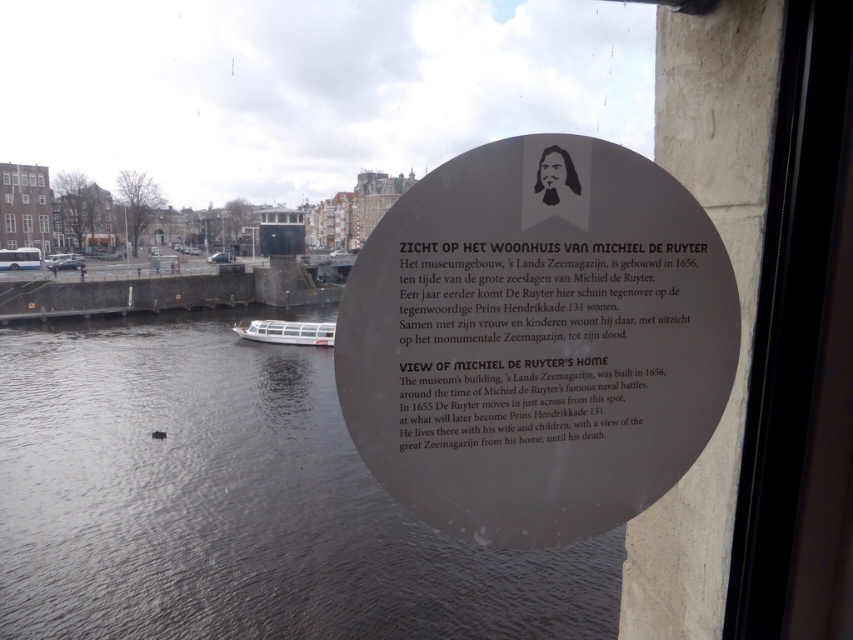
How far apart are dark blue water at lower center and white plastic boat at lower center?

29.45 feet

What do you see at coordinates (235, 506) in the screenshot? I see `dark blue water at lower center` at bounding box center [235, 506].

In order to click on dark blue water at lower center in this screenshot , I will do `click(235, 506)`.

Can you confirm if matte black plaque at center is taller than white plastic boat at lower center?

Incorrect, matte black plaque at center's height is not larger of white plastic boat at lower center's.

Between matte black plaque at center and white plastic boat at lower center, which one is positioned lower?

Positioned lower is matte black plaque at center.

Identify the location of matte black plaque at center. The width and height of the screenshot is (853, 640). (529, 340).

Where is `matte black plaque at center`? The height and width of the screenshot is (640, 853). matte black plaque at center is located at coordinates (529, 340).

Is point (519, 230) more distant than point (257, 321)?

No, it is in front of (257, 321).

Does black matte plaque at upper center come behind white plastic boat at lower center?

That is False.

The height and width of the screenshot is (640, 853). Identify the location of black matte plaque at upper center. (537, 340).